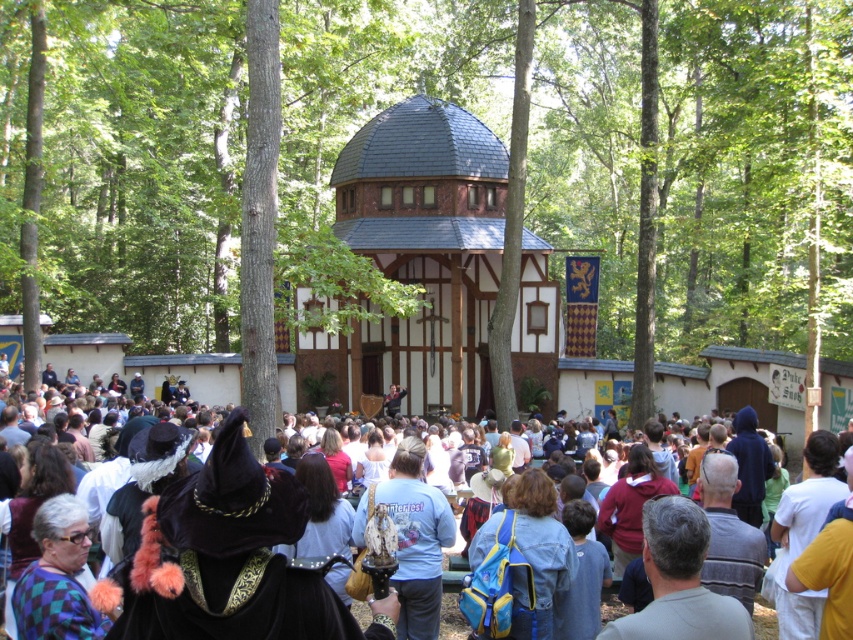
Question: In this image, where is brown wood tree at center located relative to velvet hat at center?

Choices:
 (A) right
 (B) left

Answer: (A)

Question: Which point is closer to the camera?

Choices:
 (A) (161, 88)
 (B) (288, 388)

Answer: (A)

Question: Is brown wood tree at center below velvet hat at center?

Choices:
 (A) no
 (B) yes

Answer: (A)

Question: Can you confirm if brown wood tree at center is positioned above velvet hat at center?

Choices:
 (A) yes
 (B) no

Answer: (A)

Question: Which point is farther to the camera?

Choices:
 (A) brown wood tree at center
 (B) velvet hat at center

Answer: (A)